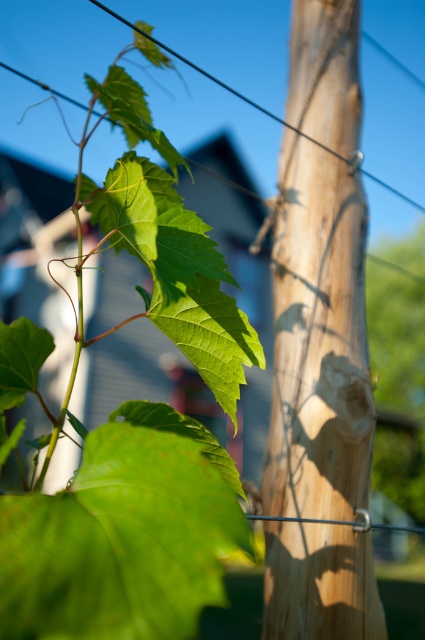
You are an artist sketching the scene and want to ensure the leaves are proportionally accurate. Which leaf should you draw smaller to maintain the correct size relationship between the green matte leaf at lower left and the green matte leaf at upper center?

The green matte leaf at lower left should be drawn smaller because it occupies less space than the green matte leaf at upper center.

From the picture: You are an artist sketching the scene and need to decide the size of each leaf. Which leaf from the green matte leaf at lower left and green matte leaf at upper center is smaller in width?

The green matte leaf at lower left is smaller in width compared to the green matte leaf at upper center.

From the picture: You are a gardener examining the grapevine leaves. You notice the green matte leaf at upper left and the green matte leaf at upper center. Which leaf is closer to you?

The green matte leaf at upper left is closer to you because it is in front of the green matte leaf at upper center.